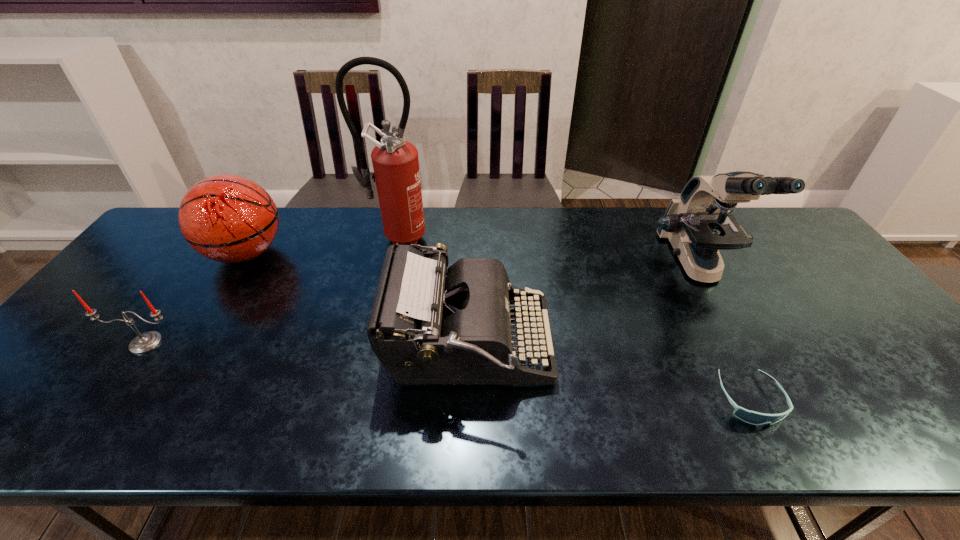
Find the location of a particular element. The width and height of the screenshot is (960, 540). free space between the fourth shortest object and the fire extinguisher is located at coordinates (322, 245).

Identify the location of object that is the closest to the tallest object. The image size is (960, 540). (429, 325).

Identify which object is the third closest to the fire extinguisher. Please provide its 2D coordinates. Your answer should be formatted as a tuple, i.e. [(x, y)], where the tuple contains the x and y coordinates of a point satisfying the conditions above.

[(145, 342)]

Where is `vacant space that satisfies the following two spatial constraints: 1. on the side with spill of the basketball; 2. on the front-facing side of the candle`? vacant space that satisfies the following two spatial constraints: 1. on the side with spill of the basketball; 2. on the front-facing side of the candle is located at coordinates (190, 343).

The width and height of the screenshot is (960, 540). I want to click on free point that satisfies the following two spatial constraints: 1. on the side with spill of the fourth shortest object; 2. on the front-facing side of the candle, so click(190, 343).

In order to click on free space that satisfies the following two spatial constraints: 1. through the eyepieces of the fifth shortest object; 2. on the front-facing side of the typewriter in this screenshot , I will do `click(741, 346)`.

At what (x,y) coordinates should I click in order to perform the action: click on free space that satisfies the following two spatial constraints: 1. through the eyepieces of the second tallest object; 2. on the front-facing side of the typewriter. Please return your answer as a coordinate pair (x, y). The width and height of the screenshot is (960, 540). Looking at the image, I should click on (741, 346).